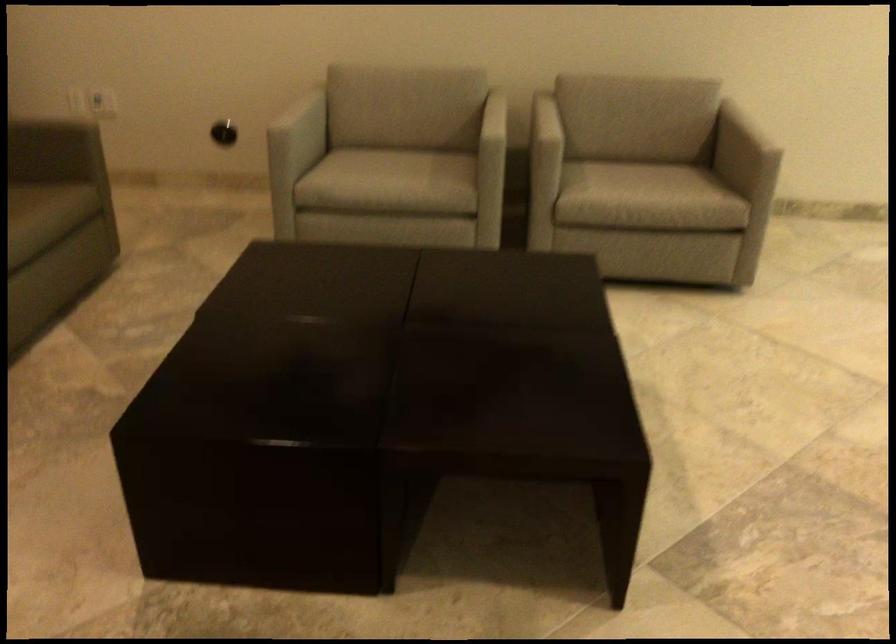
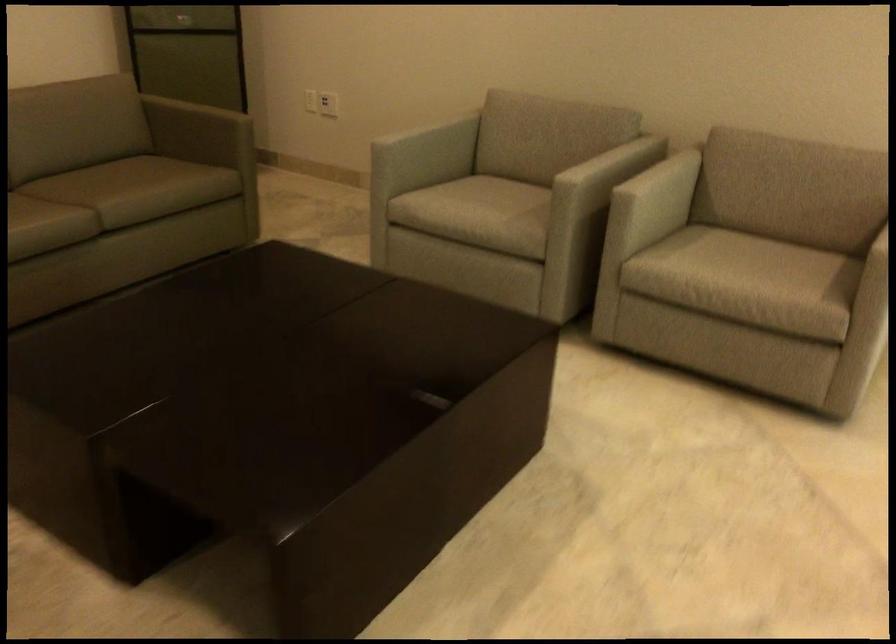
Where in the second image is the point corresponding to (290,105) from the first image?

(423, 127)